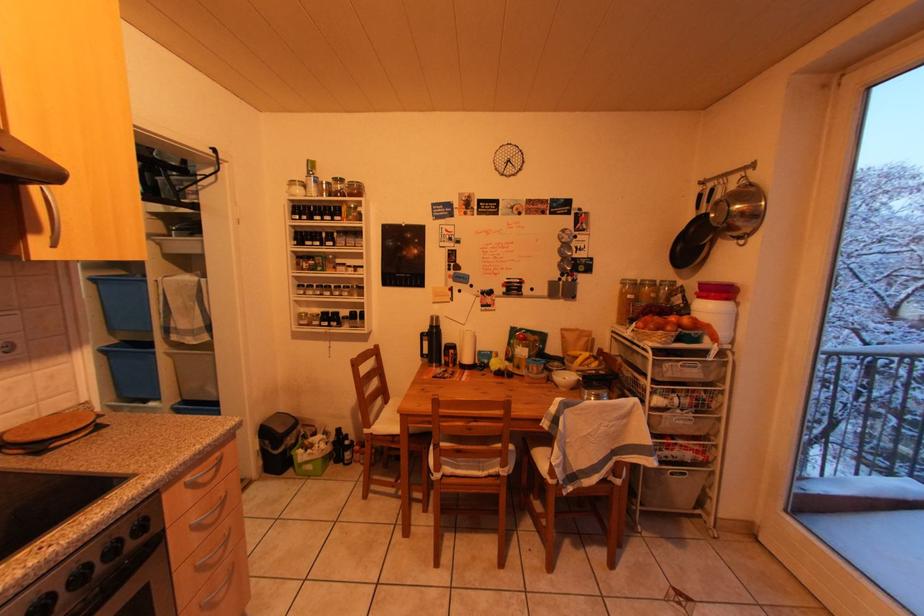
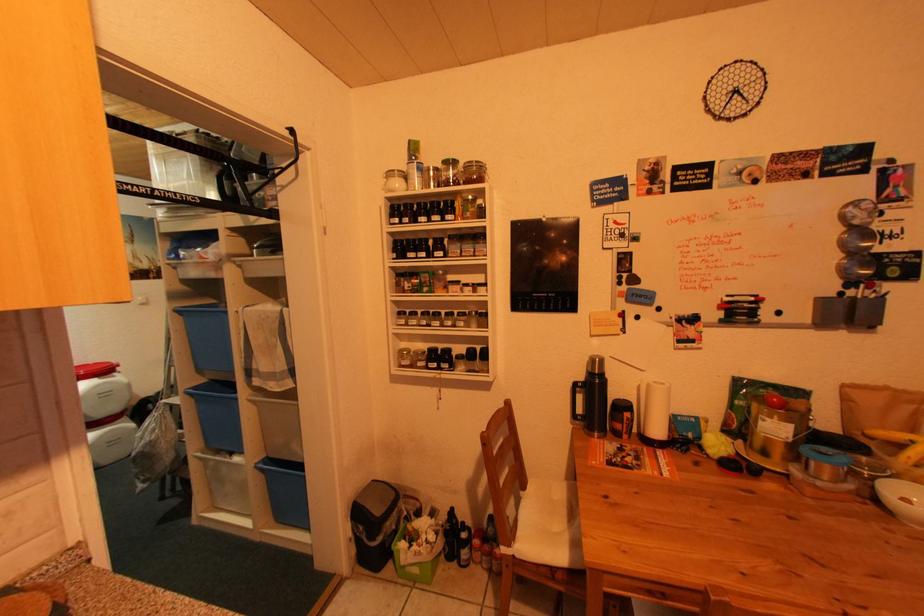
Question: The camera is either moving clockwise (left) or counter-clockwise (right) around the object. The first image is from the beginning of the video and the second image is from the end. Is the camera moving left or right when shooting the video?

Choices:
 (A) Left
 (B) Right

Answer: (B)